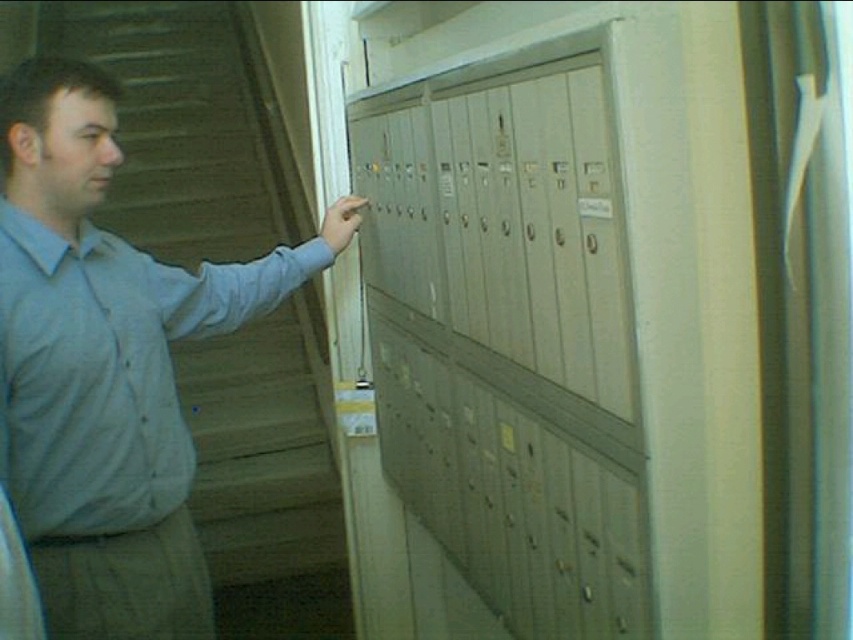
Is metallic gray locker at center wider than light blue shirt at left?

In fact, metallic gray locker at center might be narrower than light blue shirt at left.

Between point (630, 380) and point (15, 349), which one is positioned in front?

Point (630, 380)

The height and width of the screenshot is (640, 853). Find the location of `metallic gray locker at center`. metallic gray locker at center is located at coordinates (509, 332).